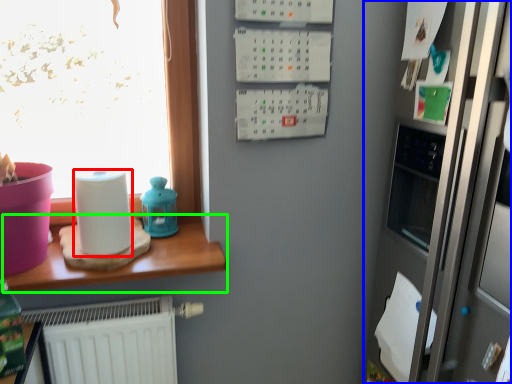
Question: Which object is the closest to the paper towel (highlighted by a red box)? Choose among these: fridge (highlighted by a blue box) or table (highlighted by a green box).

Choices:
 (A) fridge
 (B) table

Answer: (B)